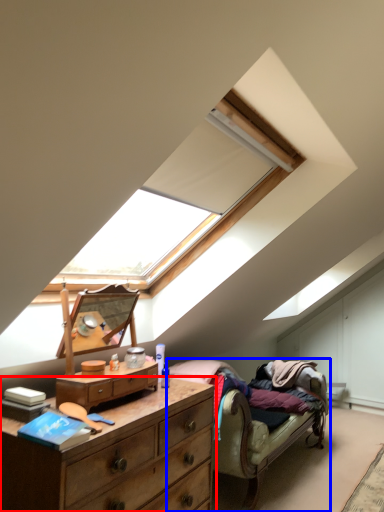
Question: Among these objects, which one is nearest to the camera, chest of drawers (highlighted by a red box) or studio couch (highlighted by a blue box)?

Choices:
 (A) chest of drawers
 (B) studio couch

Answer: (A)